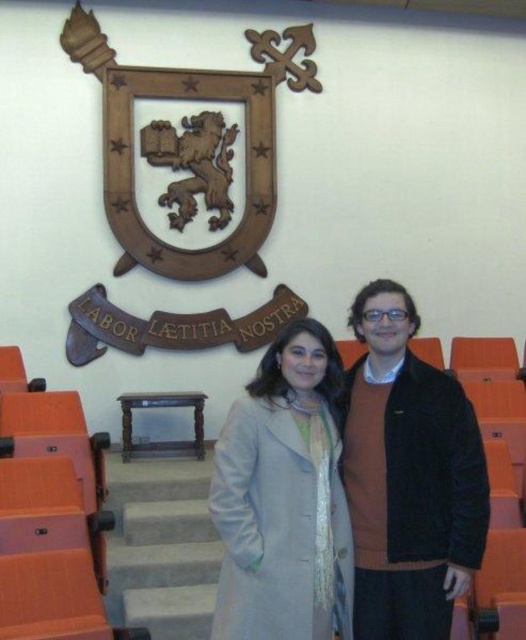
Question: Which object is closer to the camera taking this photo?

Choices:
 (A) velvet brown jacket at center
 (B) light gray wool coat at center

Answer: (A)

Question: Which point appears closest to the camera in this image?

Choices:
 (A) (356, 422)
 (B) (288, 500)

Answer: (B)

Question: Among these points, which one is farthest from the camera?

Choices:
 (A) (316, 616)
 (B) (409, 400)

Answer: (B)

Question: Does velvet brown jacket at center appear on the left side of light gray wool coat at center?

Choices:
 (A) no
 (B) yes

Answer: (A)

Question: Does velvet brown jacket at center have a greater width compared to light gray wool coat at center?

Choices:
 (A) yes
 (B) no

Answer: (B)

Question: Is velvet brown jacket at center to the left of light gray wool coat at center from the viewer's perspective?

Choices:
 (A) yes
 (B) no

Answer: (B)